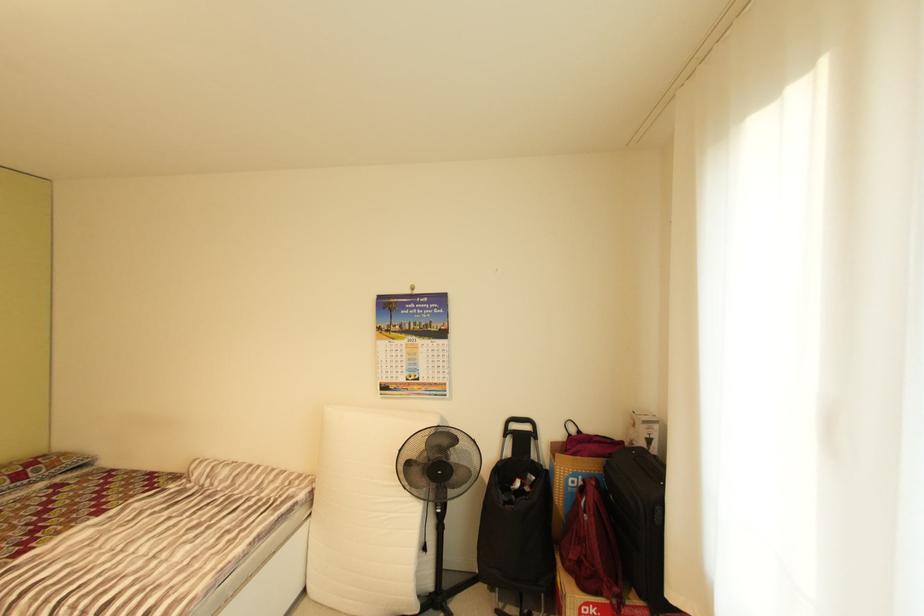
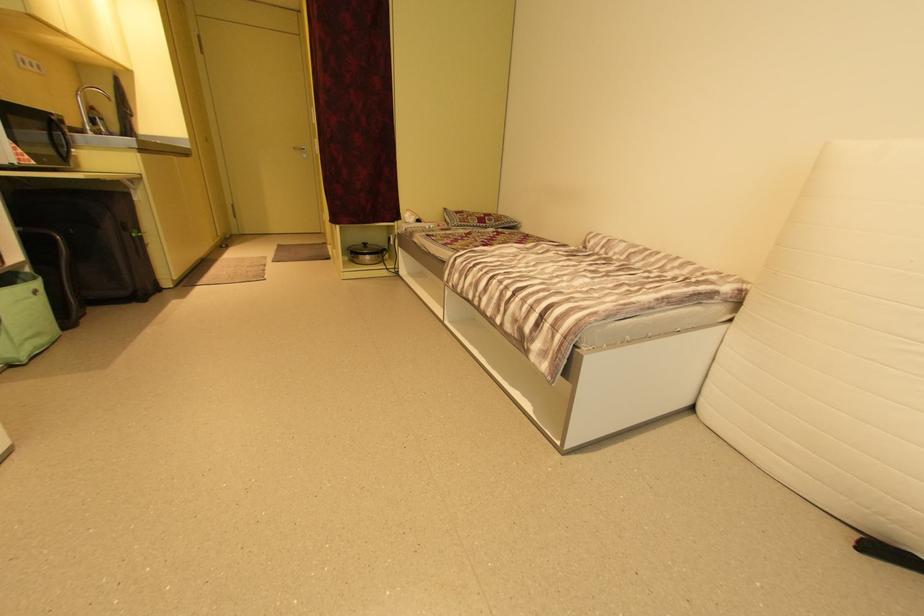
The images are taken continuously from a first-person perspective. In which direction is your viewpoint rotating?

The camera's rotation is toward left-down.